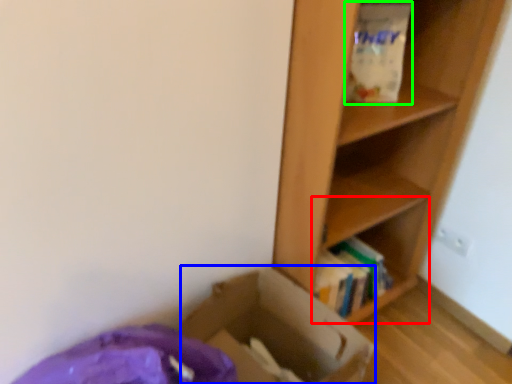
Question: Which object is the closest to the cabinet (highlighted by a red box)? Choose among these: cardboard box (highlighted by a blue box) or paper bag (highlighted by a green box).

Choices:
 (A) cardboard box
 (B) paper bag

Answer: (A)